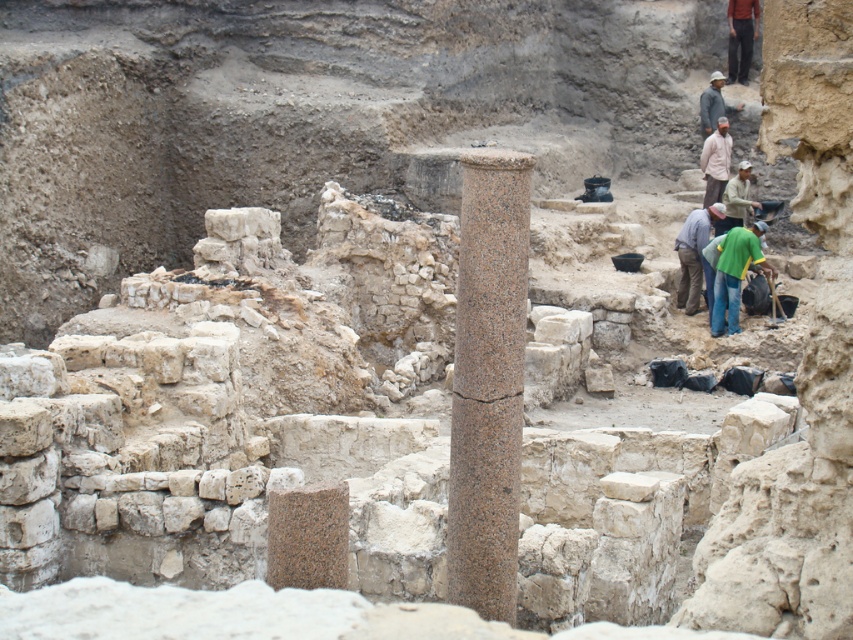
You are an archaeologist at the excavation site. You notice the granite column at center and the brown cotton shirt at center. Which object is positioned lower in the image?

The granite column at center is positioned lower than the brown cotton shirt at center in the image.

You are an archaeologist at the excavation site and need to retrieve an item from your green fabric bag at center. However, there is a brown fabric hat at upper right nearby. When you look down to reach into your bag, will the hat obstruct your view of the bag?

The green fabric bag at center is in front of the brown fabric hat at upper right, so the hat will not obstruct your view of the bag since the bag is closer to you.